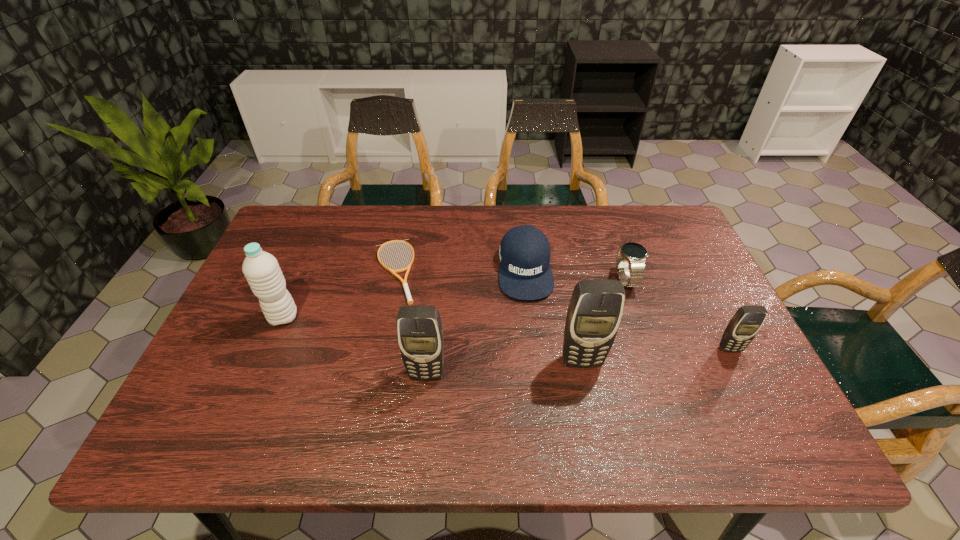
You are a GUI agent. You are given a task and a screenshot of the screen. Output one action in this format:
    pyautogui.click(x=<x>, y=<y>)
    Task: Click on the object positioned at the left edge
    The width and height of the screenshot is (960, 540).
    Given the screenshot: What is the action you would take?
    pyautogui.click(x=261, y=269)

The width and height of the screenshot is (960, 540). Identify the location of object that is positioned at the right edge. (747, 321).

In order to click on free spot at the far edge of the desktop in this screenshot , I will do point(385,235).

Image resolution: width=960 pixels, height=540 pixels. I want to click on vacant region at the near edge of the desktop, so click(486, 396).

Where is `free location at the left edge of the desktop`? free location at the left edge of the desktop is located at coordinates (239, 374).

Identify the location of vacant space at the right edge. The image size is (960, 540). (720, 326).

I want to click on free region at the far left corner of the desktop, so click(x=324, y=239).

In the image, there is a desktop. Where is `vacant space at the far right corner`? Image resolution: width=960 pixels, height=540 pixels. vacant space at the far right corner is located at coordinates (637, 230).

Where is `vacant point located between the rightmost object and the watch`? The image size is (960, 540). vacant point located between the rightmost object and the watch is located at coordinates (678, 315).

I want to click on free space between the baseball cap and the water bottle, so click(x=404, y=293).